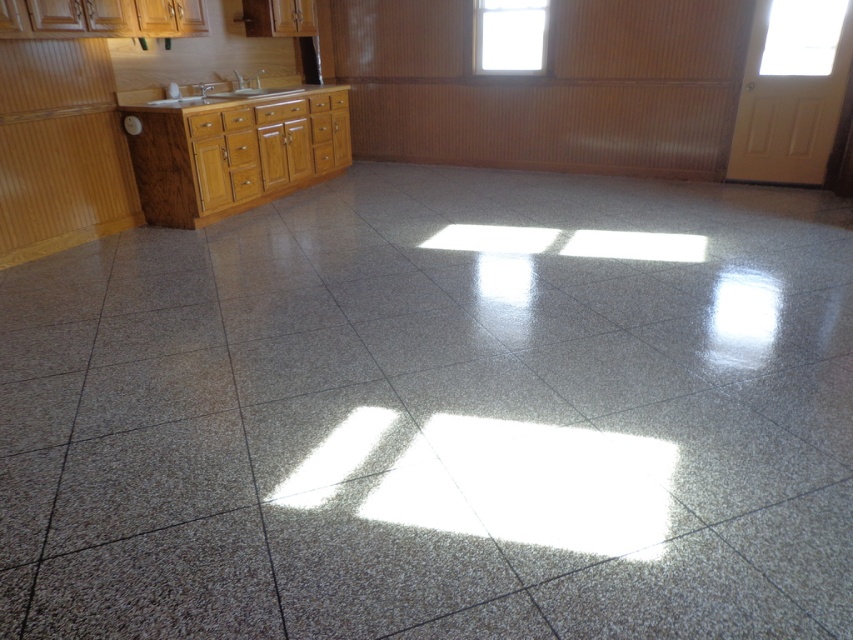
Can you confirm if transparent glass window at upper center is positioned to the left of white glossy countertop at upper left?

In fact, transparent glass window at upper center is to the right of white glossy countertop at upper left.

Does transparent glass window at upper center have a smaller size compared to white glossy countertop at upper left?

Actually, transparent glass window at upper center might be larger than white glossy countertop at upper left.

Find the location of a particular element. transparent glass window at upper center is located at coordinates (509, 36).

Is transparent glass window at upper center positioned at the back of matte silver sink at upper left?

That is True.

Which of these two, transparent glass window at upper center or matte silver sink at upper left, stands taller?

Standing taller between the two is transparent glass window at upper center.

Who is more forward, [537,49] or [234,93]?

Point [234,93] is more forward.

At what (x,y) coordinates should I click in order to perform the action: click on transparent glass window at upper center. Please return your answer as a coordinate pair (x, y). The width and height of the screenshot is (853, 640). Looking at the image, I should click on (509, 36).

Based on the photo, how far apart are wooden cabinet at left and white glossy countertop at upper left?

wooden cabinet at left is 15.51 inches from white glossy countertop at upper left.

Can you confirm if wooden cabinet at left is positioned to the right of white glossy countertop at upper left?

Indeed, wooden cabinet at left is positioned on the right side of white glossy countertop at upper left.

Who is more distant from viewer, (200, 168) or (152, 97)?

Positioned behind is point (152, 97).

Where is `wooden cabinet at left`? The width and height of the screenshot is (853, 640). wooden cabinet at left is located at coordinates (233, 152).